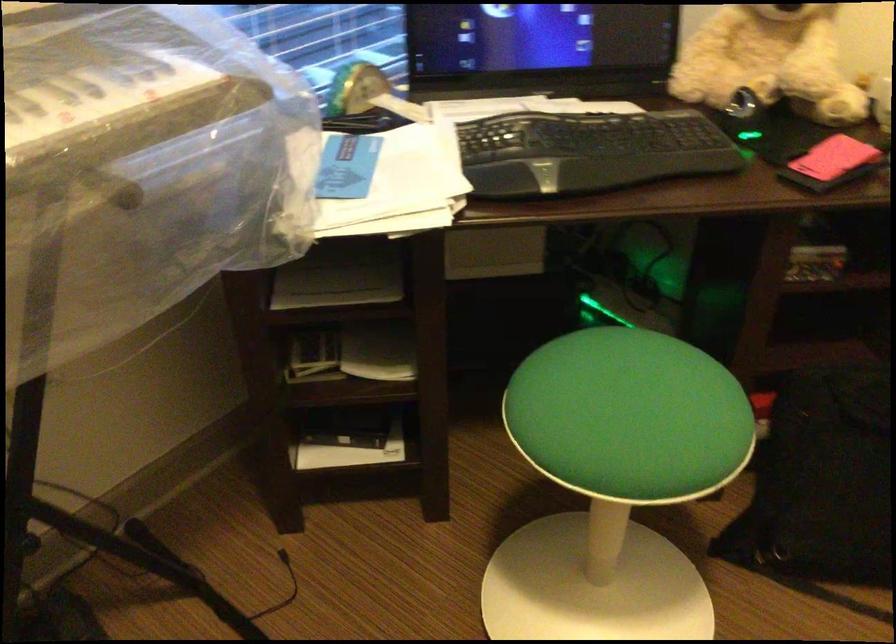
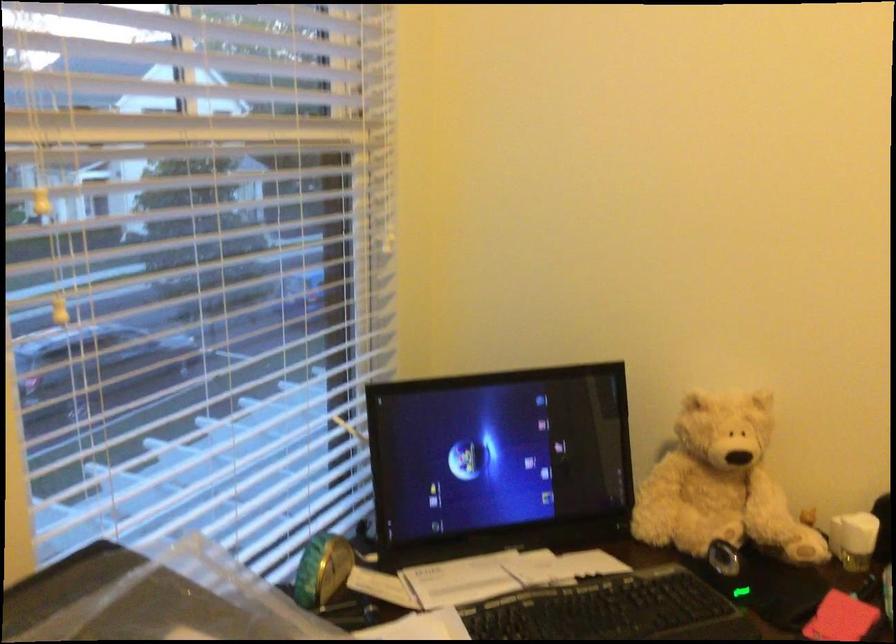
Based on the continuous images, in which direction is the camera rotating?

The rotation direction of the camera is right-up.